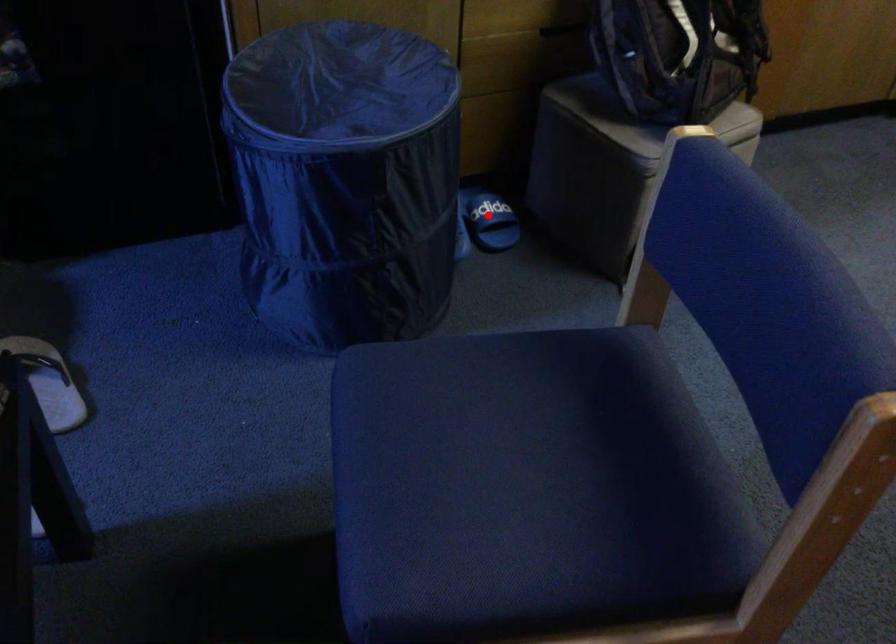
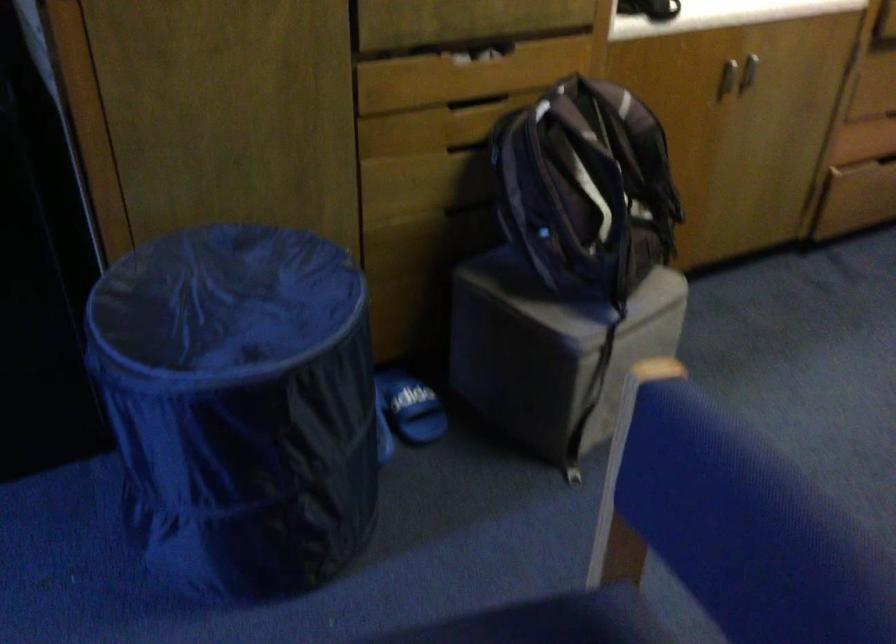
Locate, in the second image, the point that corresponds to the highlighted location in the first image.

(410, 406)